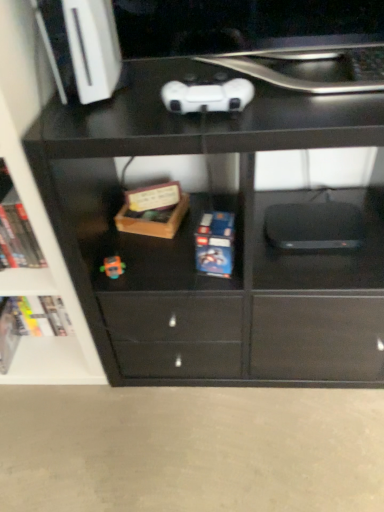
Question: Considering the relative positions of wooden box at center and white matte game controller at upper center in the image provided, is wooden box at center to the right of white matte game controller at upper center from the viewer's perspective?

Choices:
 (A) no
 (B) yes

Answer: (A)

Question: Are wooden box at center and white matte game controller at upper center making contact?

Choices:
 (A) no
 (B) yes

Answer: (A)

Question: From a real-world perspective, is wooden box at center located higher than white matte game controller at upper center?

Choices:
 (A) yes
 (B) no

Answer: (B)

Question: Does wooden box at center lie behind white matte game controller at upper center?

Choices:
 (A) yes
 (B) no

Answer: (A)

Question: Is wooden box at center taller than white matte game controller at upper center?

Choices:
 (A) no
 (B) yes

Answer: (A)

Question: Is wooden box at center aimed at white matte game controller at upper center?

Choices:
 (A) yes
 (B) no

Answer: (B)

Question: From the image's perspective, would you say hardcover book at left, which is the first paperback book from back to front, is positioned over blue matte lego box at center, the first paperback book in the right-to-left sequence?

Choices:
 (A) no
 (B) yes

Answer: (A)

Question: Is hardcover book at left, marked as the 1th paperback book in a bottom-to-top arrangement, to the left of blue matte lego box at center, the second paperback book positioned from the bottom, from the viewer's perspective?

Choices:
 (A) yes
 (B) no

Answer: (A)

Question: Is hardcover book at left, which ranks as the second paperback book in right-to-left order, not near blue matte lego box at center, the second paperback book positioned from the bottom?

Choices:
 (A) no
 (B) yes

Answer: (A)

Question: Can you confirm if hardcover book at left, the first paperback book from the left, is bigger than blue matte lego box at center, which is the second paperback book in left-to-right order?

Choices:
 (A) yes
 (B) no

Answer: (A)

Question: From a real-world perspective, is hardcover book at left, which is the first paperback book from back to front, positioned over blue matte lego box at center, the second paperback book positioned from the bottom, based on gravity?

Choices:
 (A) yes
 (B) no

Answer: (B)

Question: Does hardcover book at left, which is the first paperback book from back to front, appear on the right side of blue matte lego box at center, the second paperback book positioned from the bottom?

Choices:
 (A) yes
 (B) no

Answer: (B)

Question: From a real-world perspective, is hardcover book at lower left, the second book when ordered from front to back, located beneath wooden box at center?

Choices:
 (A) no
 (B) yes

Answer: (B)